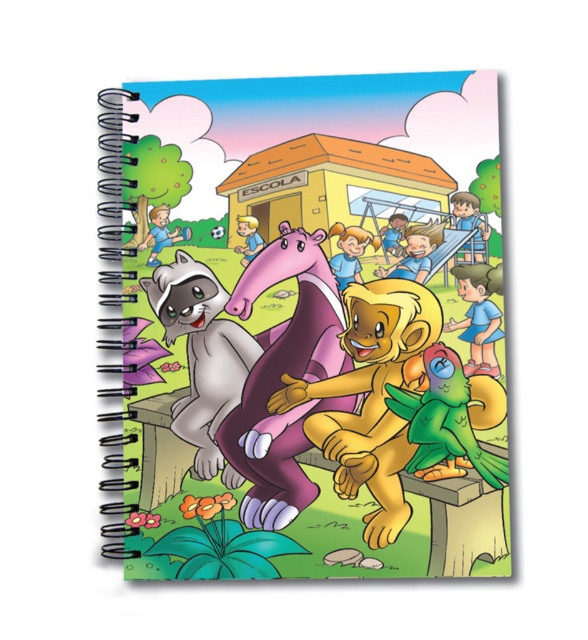
Question: Is matte plastic journal at center to the right of purple matte hippo at center from the viewer's perspective?

Choices:
 (A) yes
 (B) no

Answer: (A)

Question: Which object appears farthest from the camera in this image?

Choices:
 (A) purple matte hippo at center
 (B) yellow matte lion at center
 (C) green matte parrot at center
 (D) matte plastic journal at center

Answer: (A)

Question: Which object is the farthest from the purple matte hippo at center?

Choices:
 (A) gray furry raccoon at center
 (B) matte plastic journal at center
 (C) green matte parrot at center

Answer: (C)

Question: Is gray furry raccoon at center closer to the viewer compared to green matte parrot at center?

Choices:
 (A) no
 (B) yes

Answer: (A)

Question: Which object is positioned closest to the purple matte hippo at center?

Choices:
 (A) green matte parrot at center
 (B) matte plastic journal at center
 (C) gray furry raccoon at center

Answer: (C)

Question: Can you confirm if purple matte hippo at center is positioned to the left of green matte parrot at center?

Choices:
 (A) no
 (B) yes

Answer: (B)